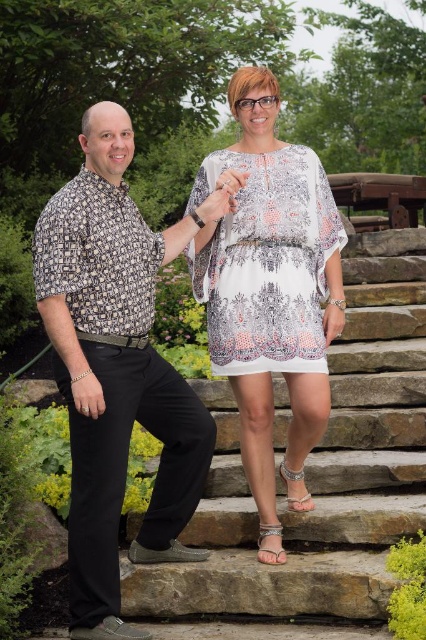
Can you confirm if white sheer dress at center is shorter than white lace hand at center?

Incorrect, white sheer dress at center's height does not fall short of white lace hand at center's.

Does white sheer dress at center have a greater width compared to white lace hand at center?

Yes.

Which is behind, point (247, 381) or point (222, 189)?

The point (247, 381) is more distant.

At what (x,y) coordinates should I click in order to perform the action: click on white sheer dress at center. Please return your answer as a coordinate pair (x, y). Looking at the image, I should click on (270, 280).

Is point (359, 496) closer to camera compared to point (259, 545)?

No, (359, 496) is further to viewer.

The image size is (426, 640). I want to click on white fabric dress at center, so click(x=321, y=467).

Locate an element on the screen. white fabric dress at center is located at coordinates (321, 467).

Looking at this image, who is more distant from viewer, (409, 250) or (207, 221)?

The point (409, 250) is more distant.

Is white fabric dress at center taller than white lace hand at center?

Yes, white fabric dress at center is taller than white lace hand at center.

Does point (351, 276) come behind point (227, 189)?

That is True.

This screenshot has width=426, height=640. What are the coordinates of `white fabric dress at center` in the screenshot? It's located at (321, 467).